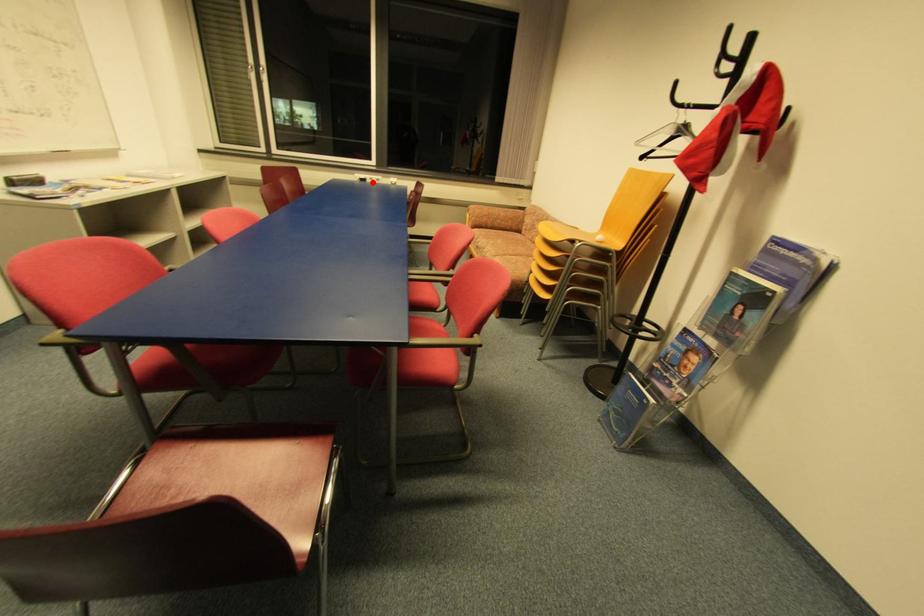
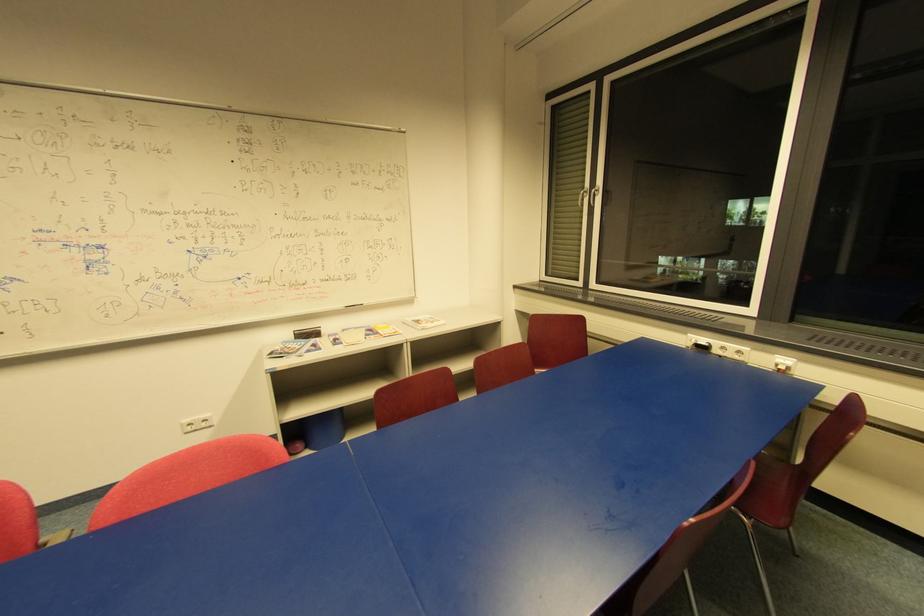
The point at the highlighted location is marked in the first image. Where is the corresponding point in the second image?

(720, 352)